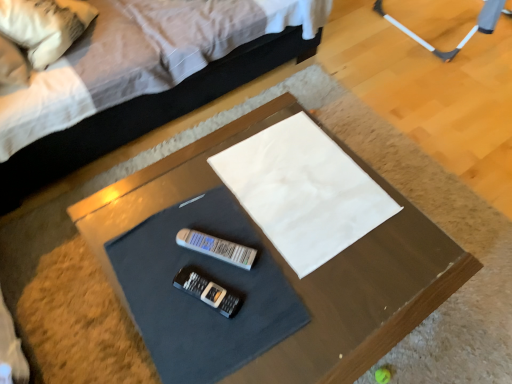
Measure the distance between point (56, 4) and camera.

4.56 feet.

In order to click on white fabric pillow at upper left in this screenshot , I will do `click(44, 26)`.

Which is in front, point (1, 14) or point (283, 190)?

The point (283, 190) is closer to the camera.

Considering the sizes of objects white fabric pillow at upper left and white fabric at center in the image provided, who is taller, white fabric pillow at upper left or white fabric at center?

Standing taller between the two is white fabric pillow at upper left.

Is white fabric pillow at upper left inside the boundaries of white fabric at center, or outside?

white fabric pillow at upper left is located beyond the bounds of white fabric at center.

Looking at the image, does white fabric pillow at upper left seem bigger or smaller compared to white fabric at center?

In the image, white fabric pillow at upper left appears to be larger than white fabric at center.

Would you say white fabric at center is outside white fabric bed at upper center?

white fabric at center lies outside white fabric bed at upper center's area.

From the image's perspective, is white fabric at center positioned above or below white fabric bed at upper center?

Based on their image positions, white fabric at center is located beneath white fabric bed at upper center.

How different are the orientations of white fabric at center and white fabric bed at upper center in degrees?

They differ by 86 degrees in their facing directions.

Between white fabric at center and white fabric bed at upper center, which one appears on the left side from the viewer's perspective?

Positioned to the left is white fabric bed at upper center.

How different are the orientations of white fabric at center and white fabric pillow at upper left in degrees?

The angular difference between white fabric at center and white fabric pillow at upper left is 45.8 degrees.

Can you confirm if white fabric at center is bigger than white fabric pillow at upper left?

No, white fabric at center is not bigger than white fabric pillow at upper left.

Is white fabric at center at the left side of white fabric pillow at upper left?

Incorrect, white fabric at center is not on the left side of white fabric pillow at upper left.

Is white fabric at center turned away from white fabric pillow at upper left?

No, white fabric pillow at upper left is not at the back of white fabric at center.

Are smooth brown table at center and white fabric bed at upper center far apart?

They are positioned close to each other.

Consider the image. Does smooth brown table at center have a lesser width compared to white fabric bed at upper center?

Indeed, smooth brown table at center has a lesser width compared to white fabric bed at upper center.

Where is `table below the white fabric bed at upper center (from the image's perspective)`? Image resolution: width=512 pixels, height=384 pixels. table below the white fabric bed at upper center (from the image's perspective) is located at coordinates (364, 296).

From their relative heights in the image, would you say smooth brown table at center is taller or shorter than white fabric bed at upper center?

smooth brown table at center is shorter than white fabric bed at upper center.

How distant is white fabric bed at upper center from white fabric pillow at upper left?

The distance of white fabric bed at upper center from white fabric pillow at upper left is 10.73 inches.

Can you confirm if white fabric bed at upper center is wider than white fabric pillow at upper left?

Indeed, white fabric bed at upper center has a greater width compared to white fabric pillow at upper left.

Which object is more forward, white fabric bed at upper center or white fabric pillow at upper left?

white fabric bed at upper center is more forward.

Is white fabric bed at upper center not within white fabric pillow at upper left?

Yes.

Is there a large distance between white fabric bed at upper center and smooth brown table at center?

No, white fabric bed at upper center is not far from smooth brown table at center.

Can you confirm if white fabric bed at upper center is positioned to the right of smooth brown table at center?

No.

Where is `table in front of the white fabric bed at upper center`? table in front of the white fabric bed at upper center is located at coordinates (364, 296).

Considering the sizes of objects white fabric bed at upper center and smooth brown table at center in the image provided, who is shorter, white fabric bed at upper center or smooth brown table at center?

Standing shorter between the two is smooth brown table at center.

In the image, is white fabric pillow at upper left positioned in front of or behind white fabric bed at upper center?

Clearly, white fabric pillow at upper left is behind white fabric bed at upper center.

Is white fabric pillow at upper left next to white fabric bed at upper center?

They are not placed beside each other.

Is white fabric pillow at upper left completely or partially outside of white fabric bed at upper center?

Actually, white fabric pillow at upper left is within white fabric bed at upper center.

Does white fabric pillow at upper left have a lesser width compared to white fabric bed at upper center?

Yes.

Locate an element on the screen. pillow that is behind the white fabric at center is located at coordinates (44, 26).

Identify the location of bed that appears above the white fabric at center (from a real-world perspective). (141, 78).

Which object lies nearer to the anchor point white fabric pillow at upper left, white fabric at center or white fabric bed at upper center?

The object closer to white fabric pillow at upper left is white fabric bed at upper center.

Looking at the image, which one is located closer to white fabric pillow at upper left, smooth brown table at center or white fabric bed at upper center?

The object closer to white fabric pillow at upper left is white fabric bed at upper center.

From the image, which object appears to be farther from white fabric bed at upper center, white fabric pillow at upper left or smooth brown table at center?

smooth brown table at center is further to white fabric bed at upper center.

Estimate the real-world distances between objects in this image. Which object is further from white fabric at center, smooth brown table at center or white fabric pillow at upper left?

white fabric pillow at upper left.

Which object lies further to the anchor point white fabric at center, white fabric pillow at upper left or white fabric bed at upper center?

white fabric pillow at upper left is positioned further to the anchor white fabric at center.

From the picture: Based on their spatial positions, is white fabric bed at upper center or smooth brown table at center closer to white fabric at center?

smooth brown table at center is closer to white fabric at center.

Based on their spatial positions, is white fabric at center or white fabric pillow at upper left further from smooth brown table at center?

The object further to smooth brown table at center is white fabric pillow at upper left.

Looking at the image, which one is located further to smooth brown table at center, white fabric pillow at upper left or white fabric bed at upper center?

Based on the image, white fabric pillow at upper left appears to be further to smooth brown table at center.

Where is `table between white fabric pillow at upper left and white fabric at center in the horizontal direction`? Image resolution: width=512 pixels, height=384 pixels. table between white fabric pillow at upper left and white fabric at center in the horizontal direction is located at coordinates (364, 296).

This screenshot has height=384, width=512. In order to click on pillow between white fabric bed at upper center and smooth brown table at center in the up-down direction in this screenshot , I will do `click(44, 26)`.

Where is `bed situated between white fabric pillow at upper left and white fabric at center from left to right`? The image size is (512, 384). bed situated between white fabric pillow at upper left and white fabric at center from left to right is located at coordinates (141, 78).

What are the coordinates of `linen between white fabric bed at upper center and smooth brown table at center vertically` in the screenshot? It's located at (303, 191).